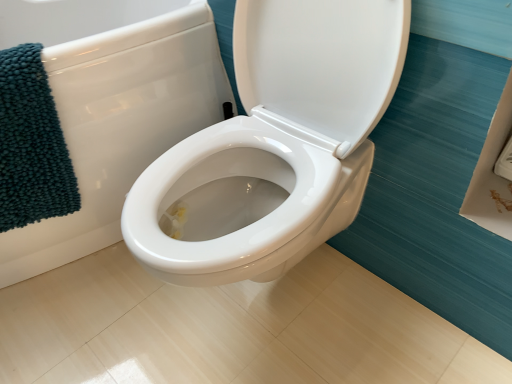
Question: Does white glossy toilet at center have a greater height compared to teal chenille bath towel at left?

Choices:
 (A) no
 (B) yes

Answer: (B)

Question: Is white glossy toilet at center oriented away from teal chenille bath towel at left?

Choices:
 (A) no
 (B) yes

Answer: (A)

Question: Can you confirm if white glossy toilet at center is shorter than teal chenille bath towel at left?

Choices:
 (A) no
 (B) yes

Answer: (A)

Question: Is white glossy toilet at center further to camera compared to teal chenille bath towel at left?

Choices:
 (A) no
 (B) yes

Answer: (A)

Question: Is white glossy toilet at center wider than teal chenille bath towel at left?

Choices:
 (A) yes
 (B) no

Answer: (A)

Question: Is white glossy toilet at center at the left side of teal chenille bath towel at left?

Choices:
 (A) yes
 (B) no

Answer: (A)

Question: Is teal chenille bath towel at left looking in the opposite direction of white glossy toilet at center?

Choices:
 (A) yes
 (B) no

Answer: (A)

Question: Is teal chenille bath towel at left in contact with white glossy toilet at center?

Choices:
 (A) no
 (B) yes

Answer: (A)

Question: Can you confirm if teal chenille bath towel at left is wider than white glossy toilet at center?

Choices:
 (A) no
 (B) yes

Answer: (A)

Question: From a real-world perspective, is teal chenille bath towel at left physically above white glossy toilet at center?

Choices:
 (A) no
 (B) yes

Answer: (B)

Question: Is teal chenille bath towel at left outside white glossy toilet at center?

Choices:
 (A) yes
 (B) no

Answer: (B)

Question: From a real-world perspective, is teal chenille bath towel at left beneath white glossy toilet at center?

Choices:
 (A) no
 (B) yes

Answer: (A)

Question: Does point (151, 107) appear closer or farther from the camera than point (4, 109)?

Choices:
 (A) closer
 (B) farther

Answer: (B)